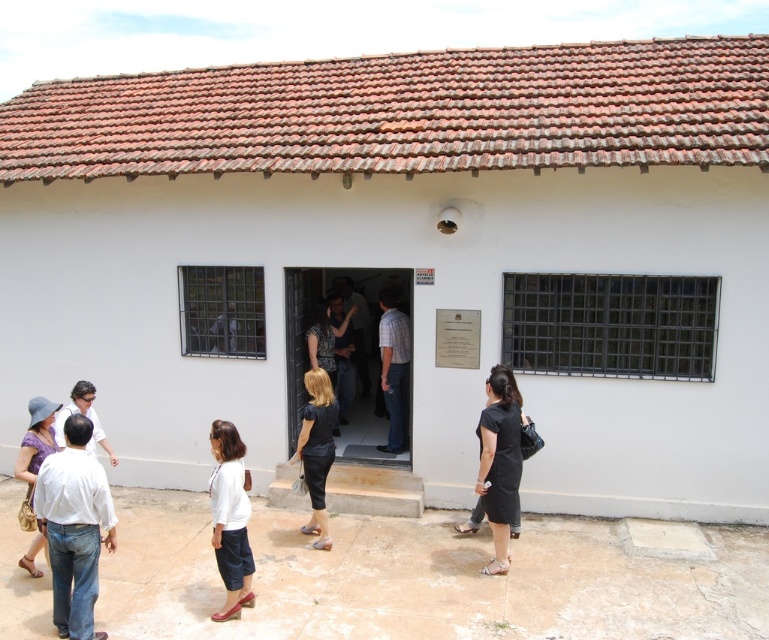
Looking at this image, can you confirm if black matte dress at lower center is positioned to the right of dark gray fabric dress at center?

Yes, black matte dress at lower center is to the right of dark gray fabric dress at center.

Which is more to the right, black matte dress at lower center or dark gray fabric dress at center?

Positioned to the right is black matte dress at lower center.

Is point (498, 556) positioned after point (338, 300)?

No, (498, 556) is in front of (338, 300).

The height and width of the screenshot is (640, 769). I want to click on black matte dress at lower center, so click(x=498, y=461).

Which is in front, point (363, 348) or point (78, 410)?

Point (78, 410) is more forward.

Who is positioned more to the left, dark gray fabric shirt at center or white shirt at center?

white shirt at center is more to the left.

Does point (345, 333) come closer to viewer compared to point (57, 426)?

No, (345, 333) is further to viewer.

At what (x,y) coordinates should I click in order to perform the action: click on dark gray fabric shirt at center. Please return your answer as a coordinate pair (x, y). This screenshot has height=640, width=769. Looking at the image, I should click on (355, 328).

Can you confirm if white cotton shirt at left is wider than dark gray fabric dress at center?

Indeed, white cotton shirt at left has a greater width compared to dark gray fabric dress at center.

In the scene shown: Does white cotton shirt at left have a lesser width compared to dark gray fabric dress at center?

No.

Is point (85, 497) less distant than point (315, 310)?

Yes, point (85, 497) is closer to viewer.

The image size is (769, 640). What are the coordinates of `white cotton shirt at left` in the screenshot? It's located at (75, 528).